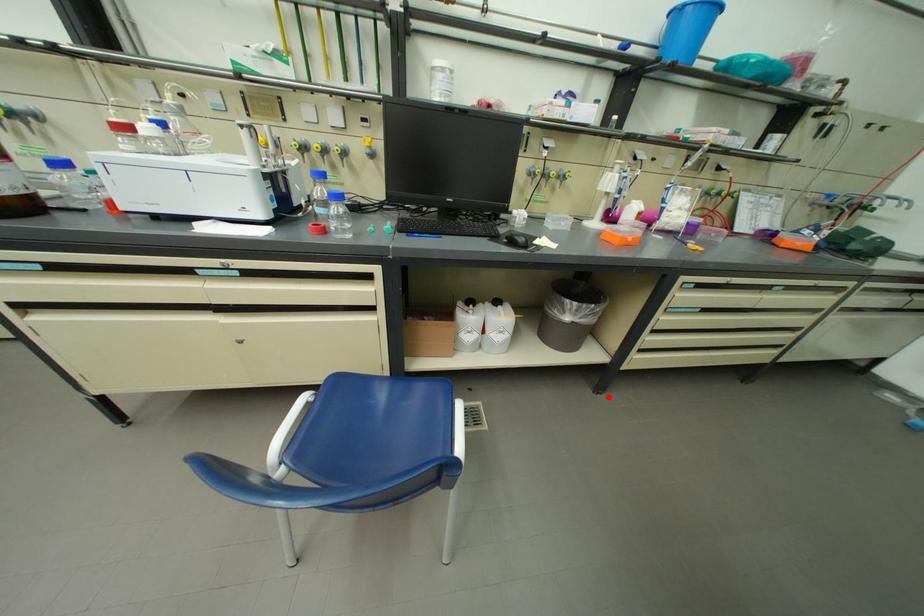
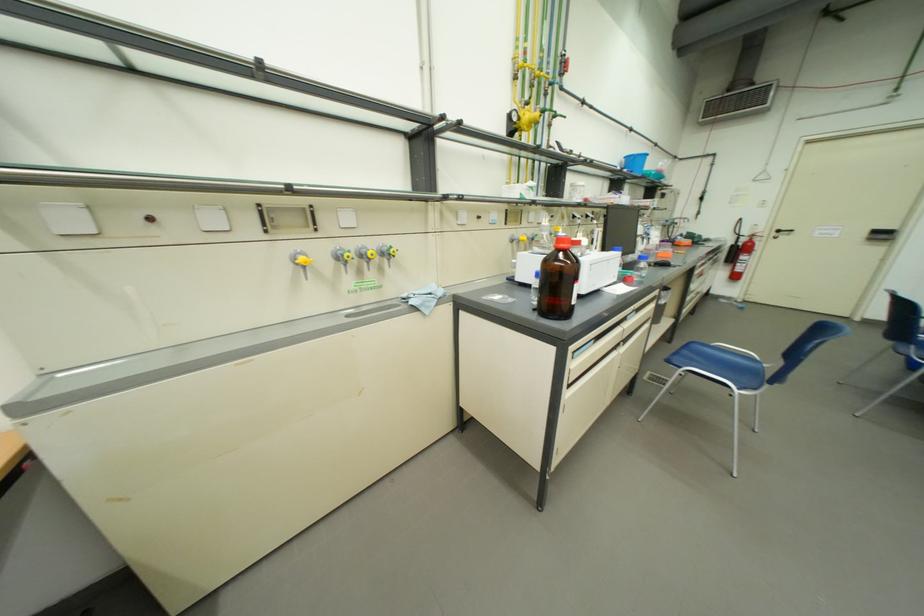
Where in the second image is the point corresponding to the highlighted location from the first image?

(681, 345)